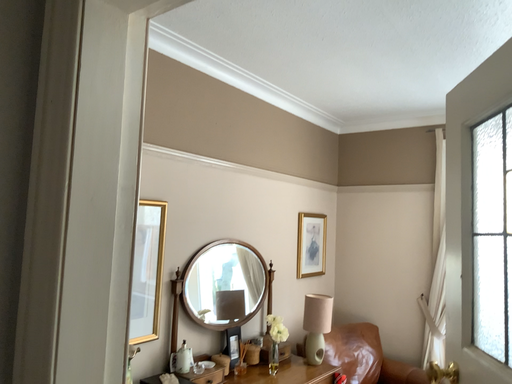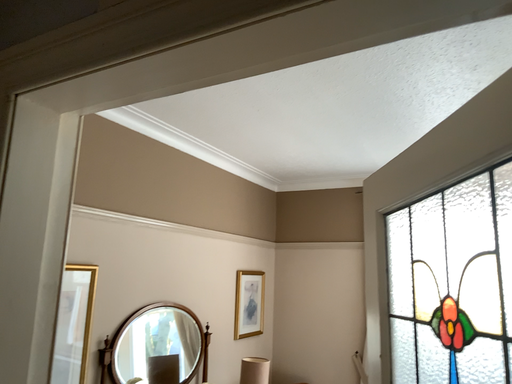
Question: Which way did the camera rotate in the video?

Choices:
 (A) rotated downward
 (B) rotated upward

Answer: (B)